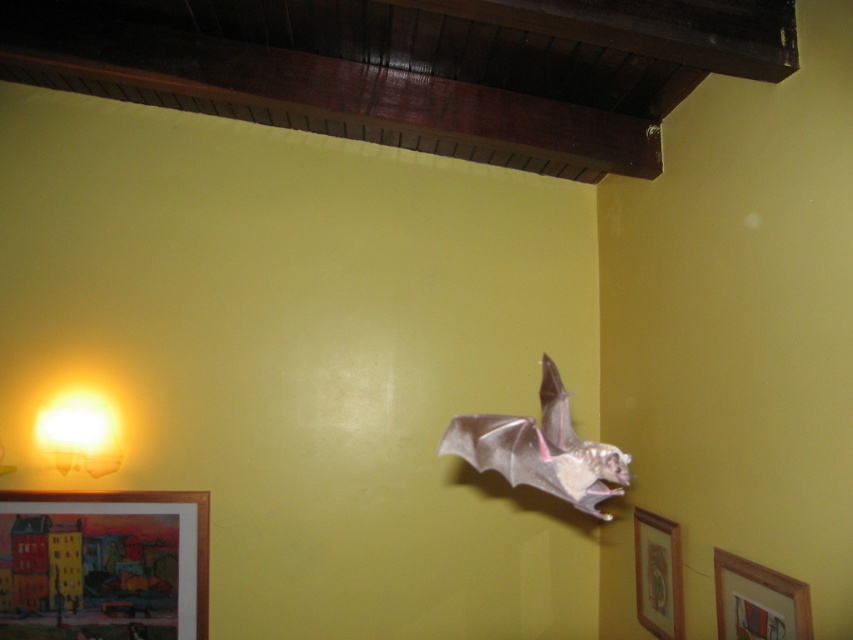
You are standing in the room and want to locate the point at coordinates (103,564). Which object is it on?

The point at coordinates (103,564) is on the wooden framed painting at lower left.

You are an interior designer assessing the placement of the wooden framed painting at lower left and the matte yellow glass lamp at lower left. Which object takes up more space in the scene?

The wooden framed painting at lower left is larger in size than the matte yellow glass lamp at lower left, so it takes up more space in the scene.

You are standing in the room and want to hang a new picture exactly where the wooden framed painting at lower left is currently placed. According to the scene description, where should you place the new picture?

You should place the new picture at the wooden framed painting at lower left, which is located at point (103,564).